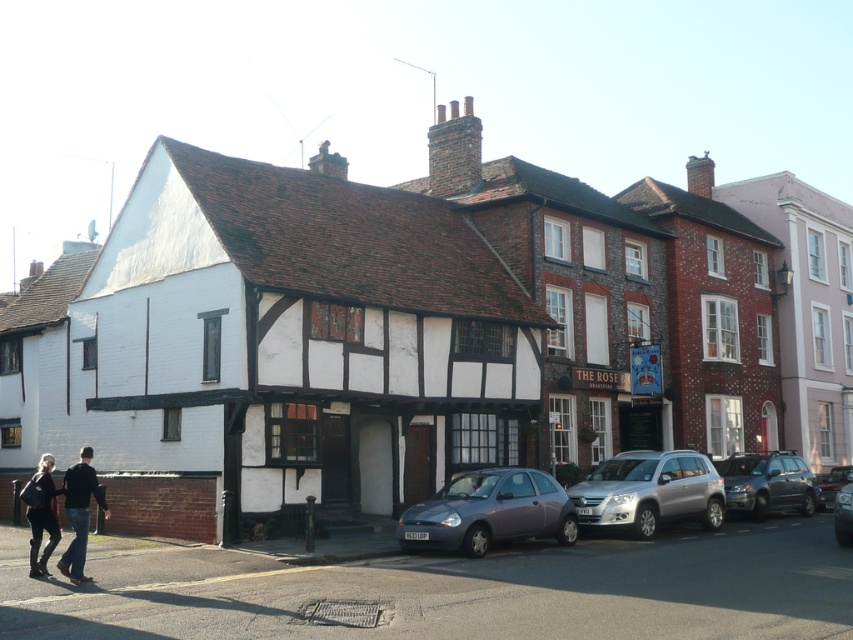
Question: Which object appears closest to the camera in this image?

Choices:
 (A) silver metallic suv at center
 (B) dark gray fabric jacket at lower left
 (C) metallic silver car at center right
 (D) black leather jacket at lower left

Answer: (D)

Question: Does metallic gray suv at center-right have a greater width compared to dark gray fabric jacket at lower left?

Choices:
 (A) no
 (B) yes

Answer: (B)

Question: Which point is farther to the camera?

Choices:
 (A) (749, 492)
 (B) (838, 529)

Answer: (A)

Question: Can you confirm if metallic gray hatchback at center is thinner than black leather jacket at lower left?

Choices:
 (A) yes
 (B) no

Answer: (B)

Question: In this image, where is black leather jacket at lower left located relative to dark gray fabric jacket at lower left?

Choices:
 (A) below
 (B) above

Answer: (B)

Question: Which of the following is the closest to the observer?

Choices:
 (A) (32, 544)
 (B) (820, 483)
 (C) (776, 506)
 (D) (834, 499)

Answer: (A)